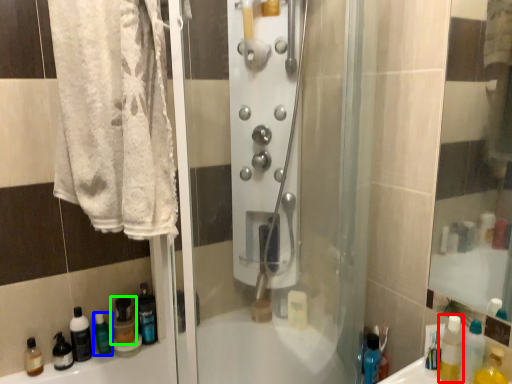
Question: Which is nearer to the mouthwash (highlighted by a red box)? cleaning product (highlighted by a blue box) or bottle (highlighted by a green box).

Choices:
 (A) cleaning product
 (B) bottle

Answer: (B)